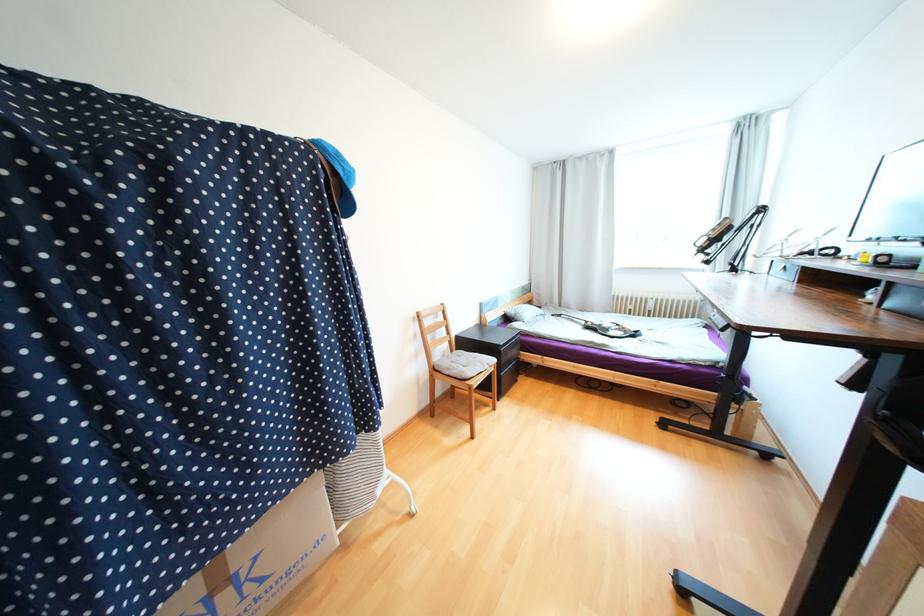
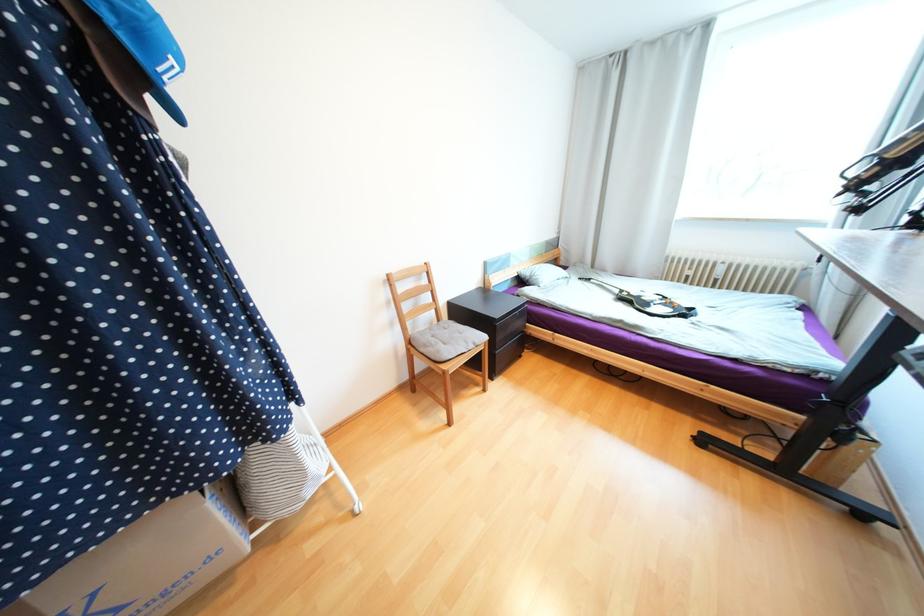
Where in the second image is the point corresponding to point (488, 363) from the first image?

(472, 342)